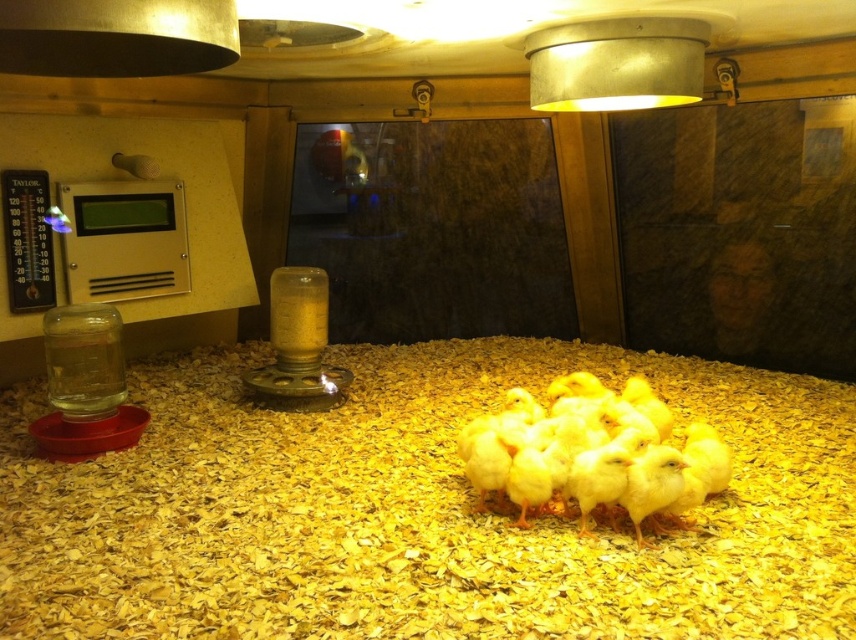
Question: Is yellow wood chips at center below yellow matte chicken at center?

Choices:
 (A) yes
 (B) no

Answer: (A)

Question: Does yellow wood chips at center have a lesser width compared to yellow matte chicken at center?

Choices:
 (A) no
 (B) yes

Answer: (A)

Question: Which object appears farthest from the camera in this image?

Choices:
 (A) yellow matte chicken at center
 (B) yellow wood chips at center

Answer: (A)

Question: Which object is closer to the camera taking this photo?

Choices:
 (A) yellow wood chips at center
 (B) yellow matte chicken at center

Answer: (A)

Question: Is yellow wood chips at center positioned in front of yellow matte chicken at center?

Choices:
 (A) yes
 (B) no

Answer: (A)